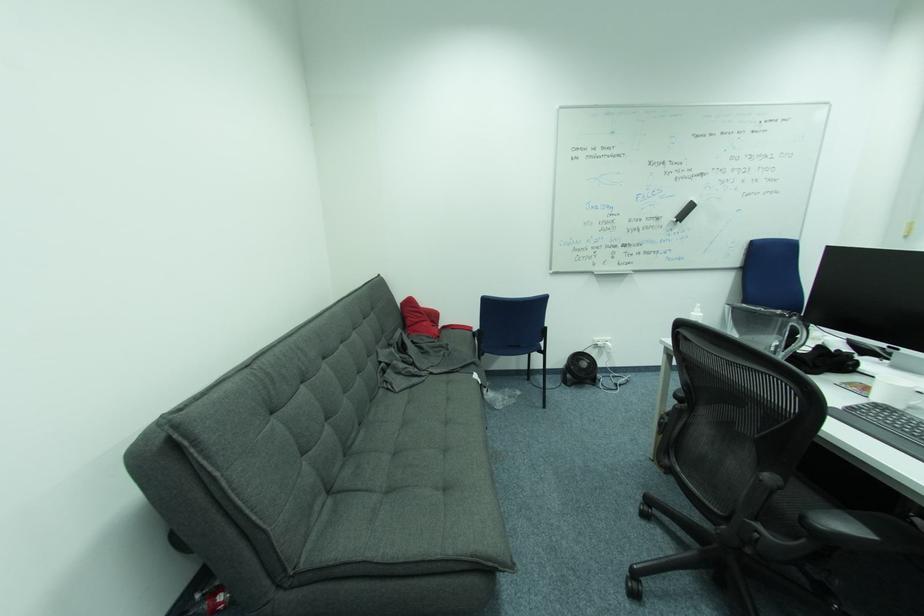
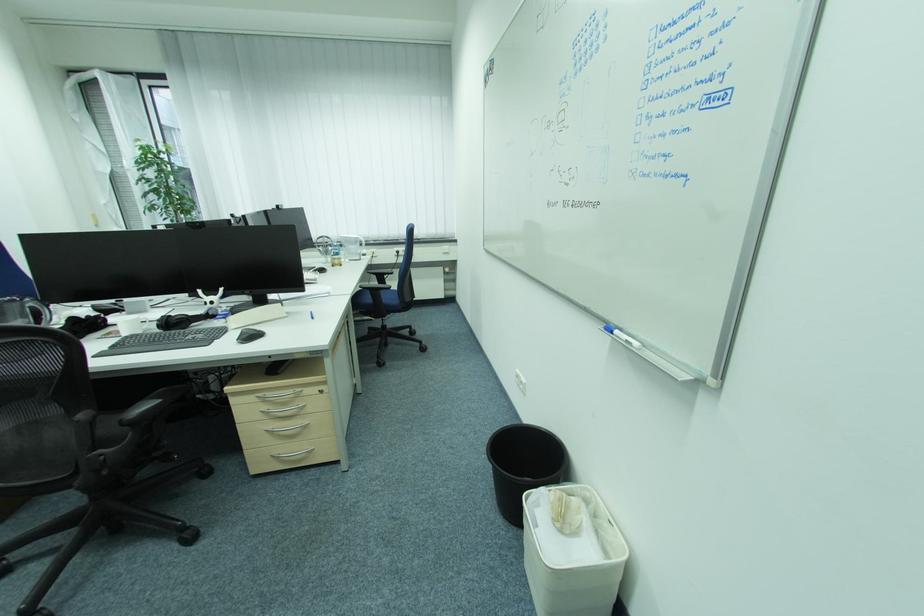
Find the pixel in the second image that matches (x=761, y=521) in the first image.

(102, 452)